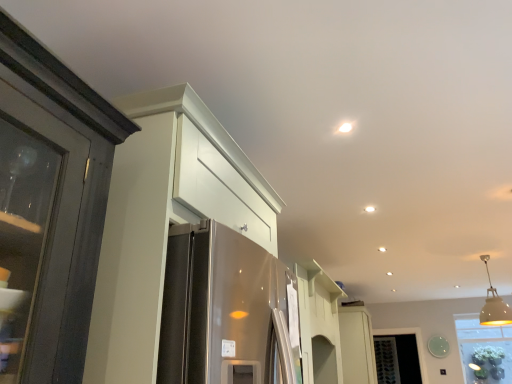
Question: Could you tell me if white glossy cabinet at center, the 1th cabinetry when ordered from back to front, is facing white glossy cabinet at upper left, acting as the 2th cabinetry starting from the back?

Choices:
 (A) no
 (B) yes

Answer: (A)

Question: Can you confirm if white glossy cabinet at center, the first cabinetry positioned from the bottom, is smaller than white glossy cabinet at upper left, the second cabinetry when ordered from bottom to top?

Choices:
 (A) no
 (B) yes

Answer: (B)

Question: From a real-world perspective, is white glossy cabinet at center, which is the 2th cabinetry in front-to-back order, physically above white glossy cabinet at upper left, positioned as the second cabinetry in right-to-left order?

Choices:
 (A) yes
 (B) no

Answer: (B)

Question: Is white glossy cabinet at center, which is the 2th cabinetry in front-to-back order, facing away from white glossy cabinet at upper left, acting as the first cabinetry starting from the front?

Choices:
 (A) yes
 (B) no

Answer: (B)

Question: Considering the relative sizes of white glossy cabinet at center, which ranks as the second cabinetry in top-to-bottom order, and white glossy cabinet at upper left, the second cabinetry when ordered from bottom to top, in the image provided, is white glossy cabinet at center, which ranks as the second cabinetry in top-to-bottom order, taller than white glossy cabinet at upper left, the second cabinetry when ordered from bottom to top,?

Choices:
 (A) no
 (B) yes

Answer: (B)

Question: From a real-world perspective, is white glossy cabinet at center, which ranks as the second cabinetry in top-to-bottom order, positioned above or below white matte pendant light at upper right?

Choices:
 (A) below
 (B) above

Answer: (A)

Question: Is white glossy cabinet at center, marked as the second cabinetry in a left-to-right arrangement, situated inside white matte pendant light at upper right or outside?

Choices:
 (A) inside
 (B) outside

Answer: (B)

Question: Is white glossy cabinet at center, which ranks as the second cabinetry in top-to-bottom order, wider or thinner than white matte pendant light at upper right?

Choices:
 (A) thin
 (B) wide

Answer: (B)

Question: Is white glossy cabinet at center, the first cabinetry positioned from the bottom, taller or shorter than white matte pendant light at upper right?

Choices:
 (A) tall
 (B) short

Answer: (A)

Question: From a real-world perspective, is white glossy cabinet at upper left, positioned as the second cabinetry in right-to-left order, above or below white glossy cabinet at center, the first cabinetry positioned from the bottom?

Choices:
 (A) above
 (B) below

Answer: (A)

Question: From their relative heights in the image, would you say white glossy cabinet at upper left, the second cabinetry when ordered from bottom to top, is taller or shorter than white glossy cabinet at center, which is the 2th cabinetry in front-to-back order?

Choices:
 (A) tall
 (B) short

Answer: (B)

Question: Looking at the image, does white glossy cabinet at upper left, the second cabinetry when ordered from bottom to top, seem bigger or smaller compared to white glossy cabinet at center, which ranks as the second cabinetry in top-to-bottom order?

Choices:
 (A) big
 (B) small

Answer: (A)

Question: Is white glossy cabinet at upper left, which ranks as the first cabinetry in top-to-bottom order, spatially inside white glossy cabinet at center, which is the 2th cabinetry in front-to-back order, or outside of it?

Choices:
 (A) inside
 (B) outside

Answer: (B)

Question: Based on their sizes in the image, would you say white glossy cabinet at upper left, the 1th cabinetry positioned from the left, is bigger or smaller than white matte pendant light at upper right?

Choices:
 (A) small
 (B) big

Answer: (B)

Question: Is white glossy cabinet at upper left, acting as the 2th cabinetry starting from the back, inside or outside of white matte pendant light at upper right?

Choices:
 (A) outside
 (B) inside

Answer: (A)